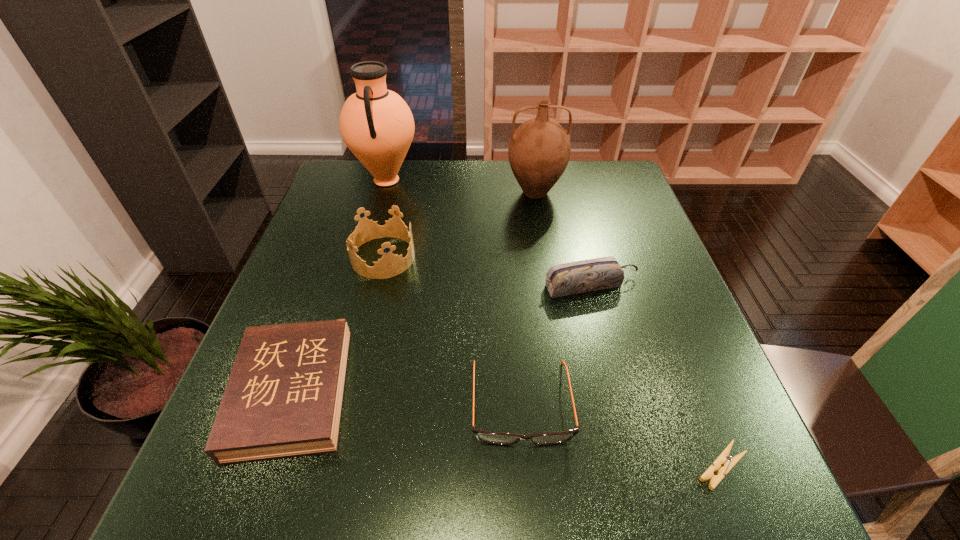
Image resolution: width=960 pixels, height=540 pixels. I want to click on the left pitcher, so click(376, 124).

Locate an element on the screen. This screenshot has width=960, height=540. the taller pitcher is located at coordinates (376, 124).

You are a GUI agent. You are given a task and a screenshot of the screen. Output one action in this format:
    pyautogui.click(x=<x>, y=<y>)
    Task: Click on the shorter pitcher
    The image size is (960, 540).
    Given the screenshot: What is the action you would take?
    pyautogui.click(x=539, y=150)

Identify the location of the right pitcher. Image resolution: width=960 pixels, height=540 pixels. (539, 150).

Identify the location of the fifth shortest object. This screenshot has height=540, width=960. (390, 265).

Find the location of a particular element. the fourth shortest object is located at coordinates (582, 276).

At what (x,y) coordinates should I click in order to perform the action: click on hardback book. Please return your answer as a coordinate pair (x, y). The width and height of the screenshot is (960, 540). Looking at the image, I should click on (284, 396).

The width and height of the screenshot is (960, 540). Find the location of `spectacles`. spectacles is located at coordinates click(x=497, y=438).

Where is `clothespin`? The width and height of the screenshot is (960, 540). clothespin is located at coordinates [x=724, y=457].

Locate an element on the screen. vacant space located on the left of the shorter pitcher is located at coordinates (392, 193).